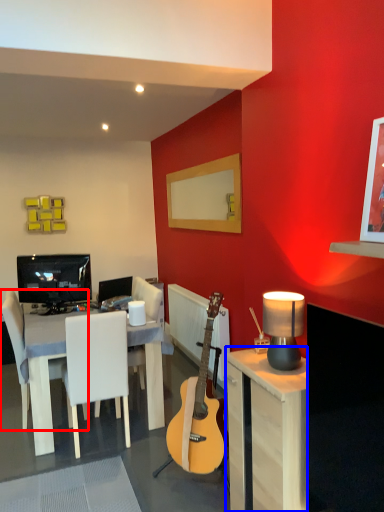
Question: Which object is further to the camera taking this photo, chair (highlighted by a red box) or desk (highlighted by a blue box)?

Choices:
 (A) chair
 (B) desk

Answer: (A)